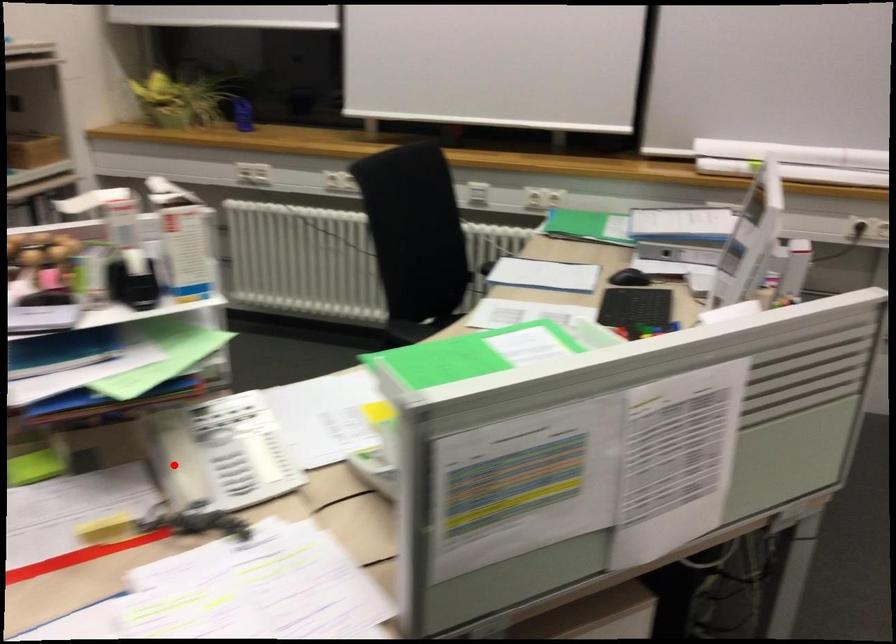
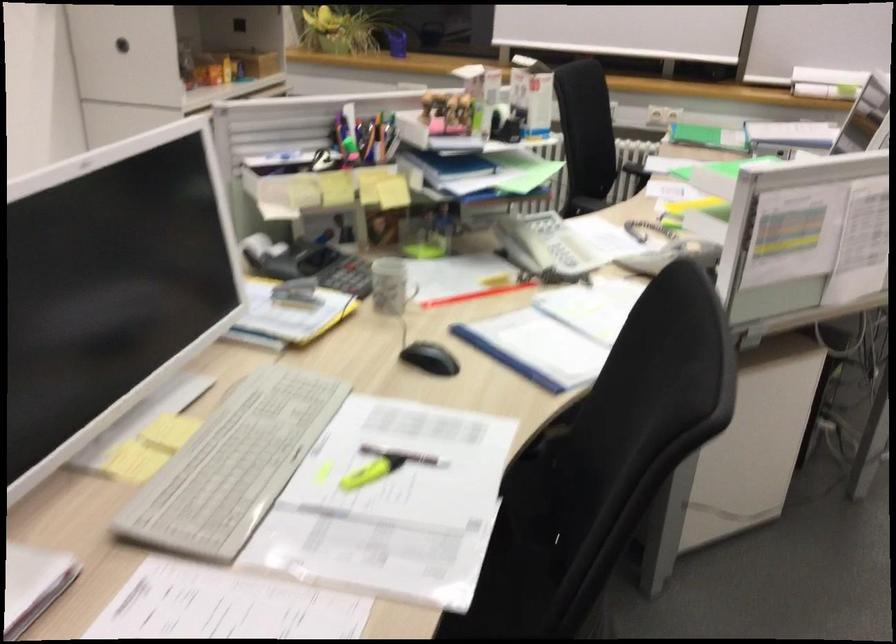
Question: A red point is marked in image1. In image2, is the corresponding 3D point closer to the camera or farther? Reply with the corresponding letter.

Choices:
 (A) The corresponding 3D point is closer.
 (B) The corresponding 3D point is farther.

Answer: (B)